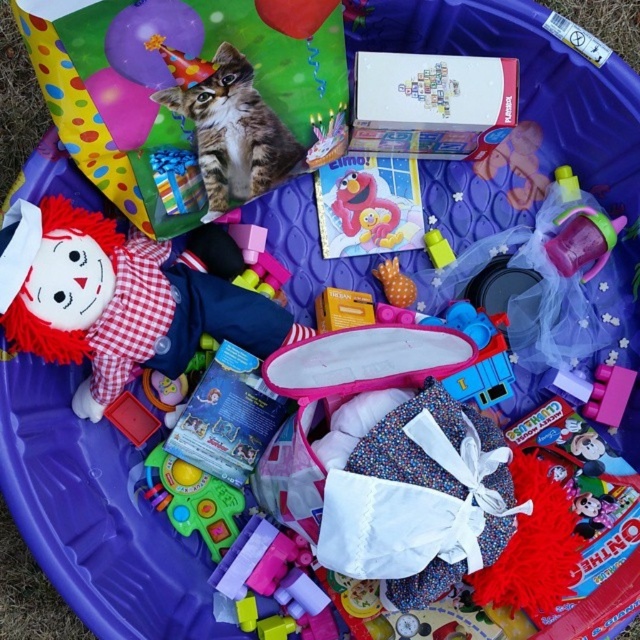
Question: Is matte pink plush elmo at center below orange dotted fabric at center?

Choices:
 (A) no
 (B) yes

Answer: (A)

Question: Can you confirm if matte pink plush elmo at center is positioned to the right of translucent plastic cup at center?

Choices:
 (A) no
 (B) yes

Answer: (A)

Question: Which of the following is the farthest from the observer?

Choices:
 (A) orange dotted fabric at center
 (B) rubberized plastic toy at center
 (C) tabby fur cat at upper left
 (D) fuzzy fabric doll at left

Answer: (A)

Question: Is fuzzy fabric doll at left to the right of matte pink plush elmo at center from the viewer's perspective?

Choices:
 (A) no
 (B) yes

Answer: (A)

Question: Which point is closer to the camera taking this photo?

Choices:
 (A) (444, 262)
 (B) (378, 272)
 (C) (244, 77)

Answer: (C)

Question: Among these points, which one is nearest to the camera?

Choices:
 (A) (244, 156)
 (B) (337, 214)

Answer: (A)